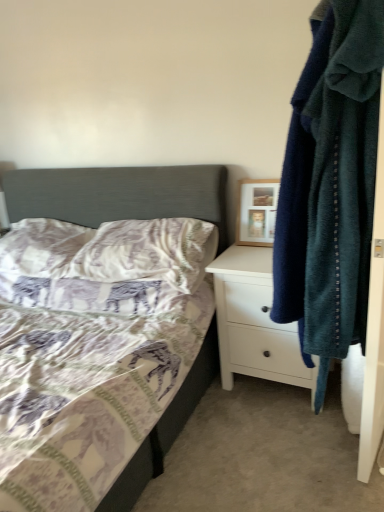
The image size is (384, 512). What do you see at coordinates (148, 252) in the screenshot?
I see `patterned fabric pillow at center, which appears as the 2th pillow when viewed from the left` at bounding box center [148, 252].

Describe the element at coordinates (256, 212) in the screenshot. I see `wooden picture frame at upper right` at that location.

The height and width of the screenshot is (512, 384). What do you see at coordinates (42, 246) in the screenshot?
I see `white textured pillow at lower left, the first pillow when ordered from left to right` at bounding box center [42, 246].

At what (x,y) coordinates should I click in order to perform the action: click on patterned fabric bed at center. Please return your answer as a coordinate pair (x, y). The image size is (384, 512). Looking at the image, I should click on (121, 194).

Is soft blue towel at right thinner than patterned fabric bed at center?

Indeed, soft blue towel at right has a lesser width compared to patterned fabric bed at center.

I want to click on bed located in front of the soft blue towel at right, so click(121, 194).

Does patterned fabric pillow at center, which appears as the 2th pillow when viewed from the left, have a greater width compared to white textured pillow at lower left, the first pillow when ordered from left to right?

Yes.

Between patterned fabric pillow at center, acting as the 1th pillow starting from the right, and white textured pillow at lower left, the first pillow when ordered from left to right, which one is positioned behind?

white textured pillow at lower left, the first pillow when ordered from left to right, is further from the camera.

Which object is positioned more to the left, patterned fabric pillow at center, acting as the 1th pillow starting from the right, or white textured pillow at lower left, which ranks as the 2th pillow in right-to-left order?

Positioned to the left is white textured pillow at lower left, which ranks as the 2th pillow in right-to-left order.

You are a GUI agent. You are given a task and a screenshot of the screen. Output one action in this format:
    pyautogui.click(x=<x>, y=<y>)
    Task: Click on the pillow positioned vertically above the white textured pillow at lower left, which ranks as the 2th pillow in right-to-left order (from a real-world perspective)
    
    Given the screenshot: What is the action you would take?
    pyautogui.click(x=148, y=252)

Considering the sizes of objects white matte chest of drawers at right and patterned fabric pillow at center, acting as the 1th pillow starting from the right, in the image provided, who is bigger, white matte chest of drawers at right or patterned fabric pillow at center, acting as the 1th pillow starting from the right,?

Bigger between the two is white matte chest of drawers at right.

Considering the positions of points (244, 319) and (175, 261), is point (244, 319) closer to camera compared to point (175, 261)?

Yes, it is.

From the picture: Which object is thinner, white matte chest of drawers at right or patterned fabric pillow at center, acting as the 1th pillow starting from the right?

Thinner between the two is patterned fabric pillow at center, acting as the 1th pillow starting from the right.

How many degrees apart are the facing directions of white matte chest of drawers at right and patterned fabric pillow at center, acting as the 1th pillow starting from the right?

The facing directions of white matte chest of drawers at right and patterned fabric pillow at center, acting as the 1th pillow starting from the right, are 1.46 degrees apart.

From a real-world perspective, is patterned fabric pillow at center, acting as the 1th pillow starting from the right, over white matte chest of drawers at right?

Yes, from a real-world perspective, patterned fabric pillow at center, acting as the 1th pillow starting from the right, is on top of white matte chest of drawers at right.

Do you think patterned fabric pillow at center, which appears as the 2th pillow when viewed from the left, is within white matte chest of drawers at right, or outside of it?

patterned fabric pillow at center, which appears as the 2th pillow when viewed from the left, is outside white matte chest of drawers at right.

Are patterned fabric pillow at center, which appears as the 2th pillow when viewed from the left, and white matte chest of drawers at right beside each other?

There is a gap between patterned fabric pillow at center, which appears as the 2th pillow when viewed from the left, and white matte chest of drawers at right.

Measure the distance from patterned fabric pillow at center, which appears as the 2th pillow when viewed from the left, to white matte chest of drawers at right.

patterned fabric pillow at center, which appears as the 2th pillow when viewed from the left, is 13.13 inches away from white matte chest of drawers at right.

Is white textured pillow at lower left, which ranks as the 2th pillow in right-to-left order, shorter than soft blue towel at right?

Correct, white textured pillow at lower left, which ranks as the 2th pillow in right-to-left order, is not as tall as soft blue towel at right.

Is white textured pillow at lower left, the first pillow when ordered from left to right, bigger or smaller than soft blue towel at right?

In the image, white textured pillow at lower left, the first pillow when ordered from left to right, appears to be smaller than soft blue towel at right.

Find the location of `pillow that is the 1st one when counting downward from the soft blue towel at right (from the image's perspective)`. pillow that is the 1st one when counting downward from the soft blue towel at right (from the image's perspective) is located at coordinates (42, 246).

From the image's perspective, is white textured pillow at lower left, which ranks as the 2th pillow in right-to-left order, above or below soft blue towel at right?

white textured pillow at lower left, which ranks as the 2th pillow in right-to-left order, is situated lower than soft blue towel at right in the image.

From a real-world perspective, does soft blue towel at right stand above white textured pillow at lower left, the first pillow when ordered from left to right?

Result: Yes.

How much distance is there between soft blue towel at right and white textured pillow at lower left, which ranks as the 2th pillow in right-to-left order?

A distance of 4.50 feet exists between soft blue towel at right and white textured pillow at lower left, which ranks as the 2th pillow in right-to-left order.

Is the depth of soft blue towel at right less than that of white textured pillow at lower left, which ranks as the 2th pillow in right-to-left order?

Yes.

Can you confirm if soft blue towel at right is taller than white textured pillow at lower left, the first pillow when ordered from left to right?

Yes, soft blue towel at right is taller than white textured pillow at lower left, the first pillow when ordered from left to right.

Where is `picture frame located above the patterned fabric bed at center (from the image's perspective)`? This screenshot has height=512, width=384. picture frame located above the patterned fabric bed at center (from the image's perspective) is located at coordinates tap(256, 212).

Is wooden picture frame at upper right surrounding patterned fabric bed at center?

No, patterned fabric bed at center is located outside of wooden picture frame at upper right.

Is wooden picture frame at upper right at the left side of patterned fabric bed at center?

No.

Is wooden picture frame at upper right taller than patterned fabric bed at center?

Incorrect, the height of wooden picture frame at upper right is not larger of that of patterned fabric bed at center.

This screenshot has width=384, height=512. In order to click on laundry that is on the right side of patterned fabric bed at center in this screenshot , I will do `click(330, 185)`.

Find the location of a particular element. This screenshot has height=512, width=384. pillow above the white textured pillow at lower left, which ranks as the 2th pillow in right-to-left order (from a real-world perspective) is located at coordinates (148, 252).

Which object lies further to the anchor point white matte chest of drawers at right, patterned fabric bed at center or soft blue towel at right?

The object further to white matte chest of drawers at right is soft blue towel at right.

Looking at the image, which one is located closer to soft blue towel at right, white matte chest of drawers at right or white textured pillow at lower left, the first pillow when ordered from left to right?

white matte chest of drawers at right.

Consider the image. From the image, which object appears to be farther from patterned fabric pillow at center, acting as the 1th pillow starting from the right, white matte chest of drawers at right or soft blue towel at right?

The object further to patterned fabric pillow at center, acting as the 1th pillow starting from the right, is soft blue towel at right.

Estimate the real-world distances between objects in this image. Which object is closer to wooden picture frame at upper right, soft blue towel at right or white matte chest of drawers at right?

The object closer to wooden picture frame at upper right is white matte chest of drawers at right.

Estimate the real-world distances between objects in this image. Which object is further from patterned fabric bed at center, patterned fabric pillow at center, acting as the 1th pillow starting from the right, or white matte chest of drawers at right?

Among the two, white matte chest of drawers at right is located further to patterned fabric bed at center.

Considering their positions, is wooden picture frame at upper right positioned further to patterned fabric bed at center than soft blue towel at right?

The object further to patterned fabric bed at center is soft blue towel at right.

Considering their positions, is soft blue towel at right positioned further to white matte chest of drawers at right than white textured pillow at lower left, the first pillow when ordered from left to right?

Based on the image, white textured pillow at lower left, the first pillow when ordered from left to right, appears to be further to white matte chest of drawers at right.

Which object lies further to the anchor point wooden picture frame at upper right, patterned fabric bed at center or white textured pillow at lower left, the first pillow when ordered from left to right?

white textured pillow at lower left, the first pillow when ordered from left to right, is further to wooden picture frame at upper right.

You are a GUI agent. You are given a task and a screenshot of the screen. Output one action in this format:
    pyautogui.click(x=<x>, y=<y>)
    Task: Click on the pillow between patterned fabric bed at center and soft blue towel at right in the horizontal direction
    The width and height of the screenshot is (384, 512).
    Given the screenshot: What is the action you would take?
    pyautogui.click(x=148, y=252)

At what (x,y) coordinates should I click in order to perform the action: click on bed between white textured pillow at lower left, which ranks as the 2th pillow in right-to-left order, and white matte chest of drawers at right, in the horizontal direction. Please return your answer as a coordinate pair (x, y). The width and height of the screenshot is (384, 512). Looking at the image, I should click on (121, 194).

Locate an element on the screen. pillow situated between white textured pillow at lower left, the first pillow when ordered from left to right, and soft blue towel at right from left to right is located at coordinates (148, 252).

Where is `picture frame between white textured pillow at lower left, which ranks as the 2th pillow in right-to-left order, and soft blue towel at right, in the horizontal direction`? picture frame between white textured pillow at lower left, which ranks as the 2th pillow in right-to-left order, and soft blue towel at right, in the horizontal direction is located at coordinates (256, 212).